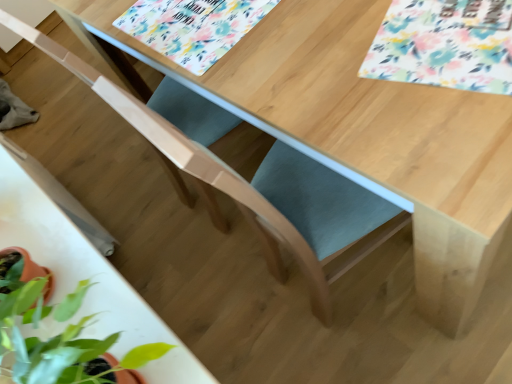
Find the location of `floral-patterned placemat at upper center, placed as the 2th flower when sorted from front to back`. floral-patterned placemat at upper center, placed as the 2th flower when sorted from front to back is located at coordinates (192, 27).

The image size is (512, 384). I want to click on floral-patterned paper at upper right, positioned as the first flower in front-to-back order, so click(x=445, y=45).

Measure the distance between point (417, 29) and camera.

A distance of 34.76 inches exists between point (417, 29) and camera.

Where is `white glossy round table at center`? This screenshot has height=384, width=512. white glossy round table at center is located at coordinates (83, 264).

I want to click on floral-patterned placemat at upper center, which appears as the first flower when viewed from the left, so click(192, 27).

Is floral-patterned placemat at upper center, which appears as the 2th flower when viewed from the right, in front of or behind floral-patterned paper at upper right, the first flower from the right, in the image?

floral-patterned placemat at upper center, which appears as the 2th flower when viewed from the right, is positioned farther from the viewer than floral-patterned paper at upper right, the first flower from the right.

From the picture: Can we say floral-patterned placemat at upper center, placed as the 2th flower when sorted from front to back, lies outside floral-patterned paper at upper right, the first flower from the right?

Yes.

Which of these two, floral-patterned placemat at upper center, placed as the 2th flower when sorted from front to back, or floral-patterned paper at upper right, the first flower from the right, is thinner?

floral-patterned placemat at upper center, placed as the 2th flower when sorted from front to back, is thinner.

Is floral-patterned paper at upper right, positioned as the first flower in front-to-back order, at the left side of floral-patterned placemat at upper center, which appears as the first flower when viewed from the back?

Incorrect, floral-patterned paper at upper right, positioned as the first flower in front-to-back order, is not on the left side of floral-patterned placemat at upper center, which appears as the first flower when viewed from the back.

From the image's perspective, which one is positioned higher, floral-patterned paper at upper right, the first flower from the right, or floral-patterned placemat at upper center, which appears as the 2th flower when viewed from the right?

From the image's view, floral-patterned placemat at upper center, which appears as the 2th flower when viewed from the right, is above.

Is there a large distance between floral-patterned paper at upper right, the 2th flower from the back, and floral-patterned placemat at upper center, which appears as the first flower when viewed from the back?

floral-patterned paper at upper right, the 2th flower from the back, is near floral-patterned placemat at upper center, which appears as the first flower when viewed from the back, not far away.

Which object is further away from the camera taking this photo, floral-patterned paper at upper right, the 2th flower positioned from the left, or floral-patterned placemat at upper center, which appears as the first flower when viewed from the left?

Positioned behind is floral-patterned placemat at upper center, which appears as the first flower when viewed from the left.

Can we say floral-patterned paper at upper right, the 2th flower positioned from the left, lies outside white glossy round table at center?

Indeed, floral-patterned paper at upper right, the 2th flower positioned from the left, is completely outside white glossy round table at center.

Does floral-patterned paper at upper right, the first flower from the right, come behind white glossy round table at center?

That is True.

Consider the image. Based on their sizes in the image, would you say floral-patterned paper at upper right, the first flower from the right, is bigger or smaller than white glossy round table at center?

Clearly, floral-patterned paper at upper right, the first flower from the right, is smaller in size than white glossy round table at center.

From a real-world perspective, is floral-patterned paper at upper right, positioned as the first flower in front-to-back order, located higher than white glossy round table at center?

Incorrect, from a real-world perspective, floral-patterned paper at upper right, positioned as the first flower in front-to-back order, is lower than white glossy round table at center.

Between white glossy round table at center and floral-patterned placemat at upper center, which appears as the first flower when viewed from the left, which one is positioned in front?

white glossy round table at center is more forward.

Based on the photo, which of these two, white glossy round table at center or floral-patterned placemat at upper center, which appears as the first flower when viewed from the back, is wider?

floral-patterned placemat at upper center, which appears as the first flower when viewed from the back, is wider.

Is white glossy round table at center not inside floral-patterned placemat at upper center, which appears as the first flower when viewed from the left?

Yes.

Which is nearer, (x=113, y=352) or (x=207, y=62)?

Point (x=113, y=352) is positioned closer to the camera compared to point (x=207, y=62).

Based on their sizes in the image, would you say floral-patterned placemat at upper center, which appears as the 2th flower when viewed from the right, is bigger or smaller than white glossy round table at center?

floral-patterned placemat at upper center, which appears as the 2th flower when viewed from the right, is smaller than white glossy round table at center.

Does floral-patterned placemat at upper center, which appears as the 2th flower when viewed from the right, have a greater height compared to white glossy round table at center?

Incorrect, the height of floral-patterned placemat at upper center, which appears as the 2th flower when viewed from the right, is not larger of that of white glossy round table at center.

Does point (173, 27) come closer to viewer compared to point (97, 275)?

No, (173, 27) is further to viewer.

Between white glossy round table at center and floral-patterned paper at upper right, the 2th flower positioned from the left, which one has less height?

Standing shorter between the two is floral-patterned paper at upper right, the 2th flower positioned from the left.

Considering the positions of objects white glossy round table at center and floral-patterned paper at upper right, the first flower from the right, in the image provided, who is more to the right, white glossy round table at center or floral-patterned paper at upper right, the first flower from the right,?

Positioned to the right is floral-patterned paper at upper right, the first flower from the right.

Is white glossy round table at center far from floral-patterned paper at upper right, the 2th flower from the back?

white glossy round table at center is actually quite close to floral-patterned paper at upper right, the 2th flower from the back.

Which object is more forward, white glossy round table at center or floral-patterned paper at upper right, positioned as the first flower in front-to-back order?

white glossy round table at center is more forward.

This screenshot has height=384, width=512. In order to click on flower behind the floral-patterned paper at upper right, the 2th flower positioned from the left in this screenshot , I will do `click(192, 27)`.

This screenshot has width=512, height=384. In the image, there is a floral-patterned paper at upper right, the 2th flower from the back. Identify the location of flower above it (from the image's perspective). (192, 27).

Looking at the image, which one is located closer to floral-patterned placemat at upper center, placed as the 2th flower when sorted from front to back, white glossy round table at center or floral-patterned paper at upper right, the 2th flower from the back?

floral-patterned paper at upper right, the 2th flower from the back, is positioned closer to the anchor floral-patterned placemat at upper center, placed as the 2th flower when sorted from front to back.

Looking at the image, which one is located further to floral-patterned paper at upper right, the 2th flower positioned from the left, white glossy round table at center or floral-patterned placemat at upper center, which appears as the 2th flower when viewed from the right?

The object further to floral-patterned paper at upper right, the 2th flower positioned from the left, is white glossy round table at center.

Which object lies nearer to the anchor point white glossy round table at center, floral-patterned placemat at upper center, placed as the 2th flower when sorted from front to back, or floral-patterned paper at upper right, the first flower from the right?

The object closer to white glossy round table at center is floral-patterned placemat at upper center, placed as the 2th flower when sorted from front to back.

Estimate the real-world distances between objects in this image. Which object is further from white glossy round table at center, floral-patterned paper at upper right, positioned as the first flower in front-to-back order, or floral-patterned placemat at upper center, placed as the 2th flower when sorted from front to back?

floral-patterned paper at upper right, positioned as the first flower in front-to-back order, lies further to white glossy round table at center than the other object.

In the scene shown: When comparing their distances from floral-patterned paper at upper right, the 2th flower positioned from the left, does floral-patterned placemat at upper center, which appears as the first flower when viewed from the left, or white glossy round table at center seem further?

Based on the image, white glossy round table at center appears to be further to floral-patterned paper at upper right, the 2th flower positioned from the left.

In the scene shown: Which object lies nearer to the anchor point floral-patterned placemat at upper center, placed as the 2th flower when sorted from front to back, floral-patterned paper at upper right, the 2th flower positioned from the left, or white glossy round table at center?

floral-patterned paper at upper right, the 2th flower positioned from the left, is positioned closer to the anchor floral-patterned placemat at upper center, placed as the 2th flower when sorted from front to back.

Where is `flower located between white glossy round table at center and floral-patterned placemat at upper center, placed as the 2th flower when sorted from front to back, in the depth direction`? The height and width of the screenshot is (384, 512). flower located between white glossy round table at center and floral-patterned placemat at upper center, placed as the 2th flower when sorted from front to back, in the depth direction is located at coordinates (445, 45).